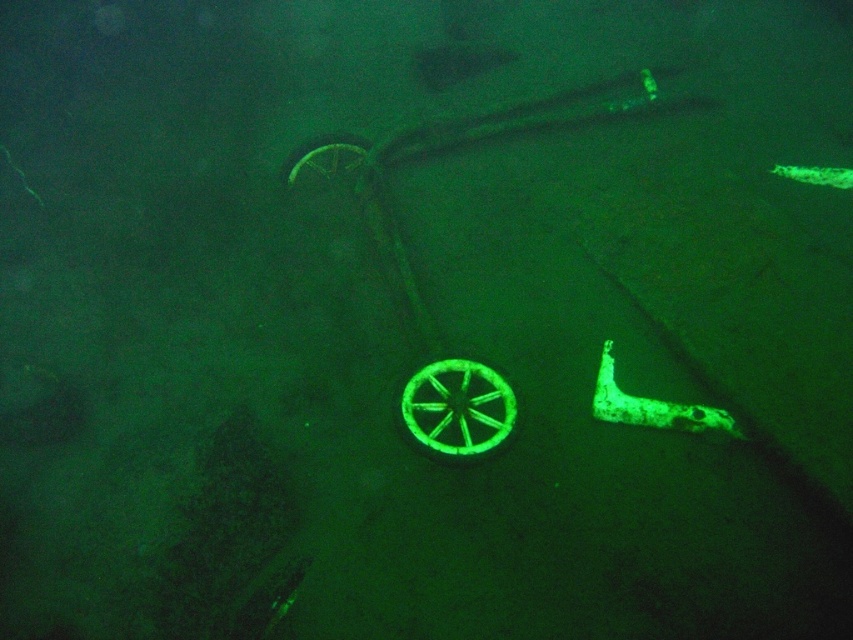
Is point (447, 448) less distant than point (339, 152)?

Yes, it is in front of point (339, 152).

Does point (405, 429) lie in front of point (334, 140)?

Yes, point (405, 429) is in front of point (334, 140).

What are the coordinates of `green matte wheel at center` in the screenshot? It's located at (457, 410).